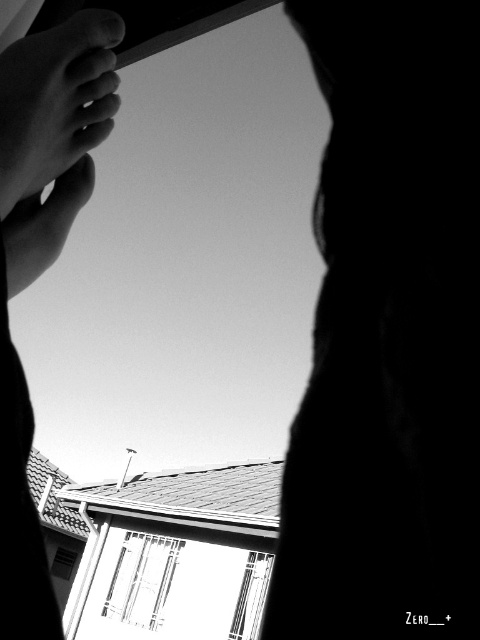
Which of these two, matte skin at upper left or metallic glass window at lower center, stands shorter?

Standing shorter between the two is matte skin at upper left.

Does matte skin at upper left have a greater height compared to metallic glass window at lower center?

No, matte skin at upper left is not taller than metallic glass window at lower center.

Where is `matte skin at upper left`? This screenshot has width=480, height=640. matte skin at upper left is located at coordinates (56, 100).

Where is `matte skin at upper left`? This screenshot has width=480, height=640. matte skin at upper left is located at coordinates (56, 100).

Is matte skin at upper left positioned in front of clear glass window at center?

Yes, matte skin at upper left is closer to the viewer.

The width and height of the screenshot is (480, 640). In order to click on matte skin at upper left in this screenshot , I will do `click(56, 100)`.

You are a GUI agent. You are given a task and a screenshot of the screen. Output one action in this format:
    pyautogui.click(x=<x>, y=<y>)
    Task: Click on the matte skin at upper left
    The image size is (480, 640).
    Given the screenshot: What is the action you would take?
    pyautogui.click(x=56, y=100)

Can you confirm if clear glass window at center is shorter than metallic glass window at lower center?

In fact, clear glass window at center may be taller than metallic glass window at lower center.

Find the location of a particular element. clear glass window at center is located at coordinates (142, 579).